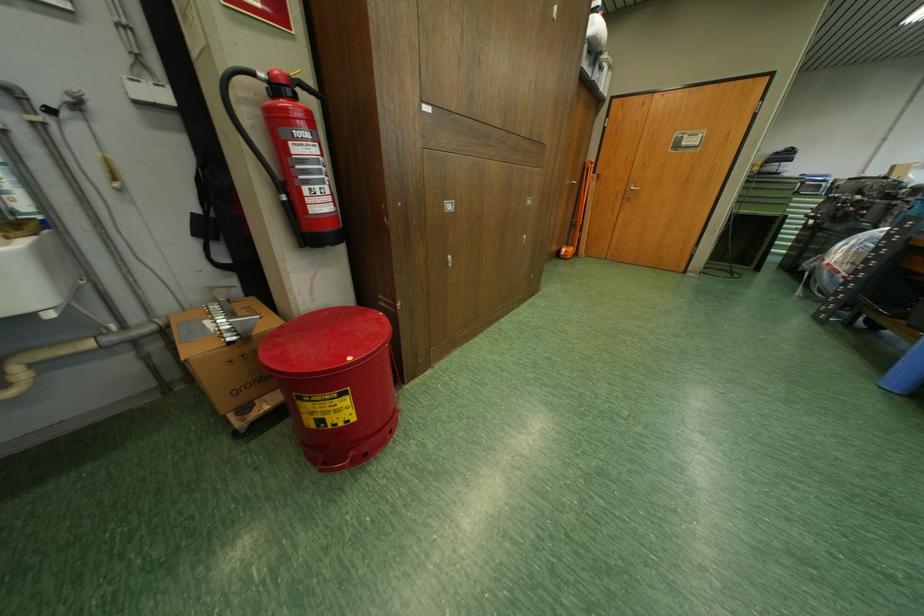
I want to click on orange tool handle, so click(x=580, y=204).